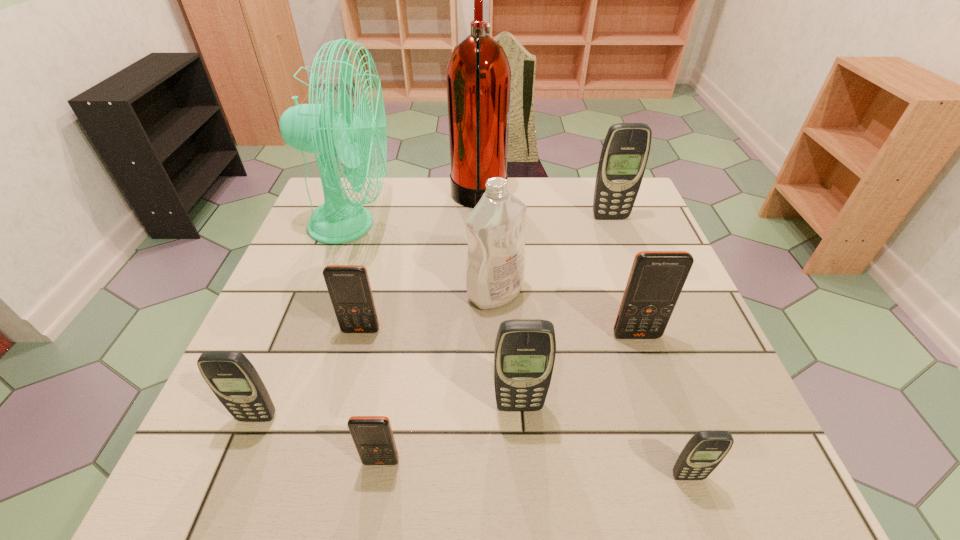
This screenshot has width=960, height=540. I want to click on vacant space located on the screen of the tallest cellular telephone, so click(617, 238).

Locate an element on the screen. This screenshot has width=960, height=540. vacant region located on the screen of the rightmost orange cellular telephone is located at coordinates (676, 453).

Identify the location of free region located on the screen of the fourth cellular telephone from right to left. (521, 438).

Locate an element on the screen. Image resolution: width=960 pixels, height=540 pixels. free region located 0.070m on the screen of the leftmost cellular telephone is located at coordinates (240, 461).

What are the coordinates of `free space located 0.250m on the screen of the second cellular telephone from left to right` in the screenshot? It's located at (331, 449).

At what (x,y) coordinates should I click in order to perform the action: click on fire extinguisher situated at the far edge. Please return your answer as a coordinate pair (x, y). This screenshot has height=540, width=960. Looking at the image, I should click on (478, 77).

At what (x,y) coordinates should I click in order to perform the action: click on fan located in the far edge section of the desktop. Please return your answer as a coordinate pair (x, y). Looking at the image, I should click on (315, 128).

Where is `cellular telephone present at the far edge`? The image size is (960, 540). cellular telephone present at the far edge is located at coordinates (625, 151).

Where is `fan located at the left edge`? The image size is (960, 540). fan located at the left edge is located at coordinates (315, 128).

Identify the location of cellular telephone situated at the left edge. (233, 379).